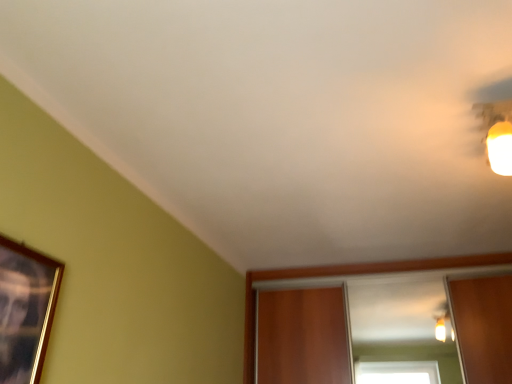
This screenshot has width=512, height=384. Describe the element at coordinates (25, 310) in the screenshot. I see `gold-framed picture at left` at that location.

This screenshot has height=384, width=512. What are the coordinates of `gold-framed picture at left` in the screenshot? It's located at (25, 310).

Identify the location of gold-framed picture at left. (25, 310).